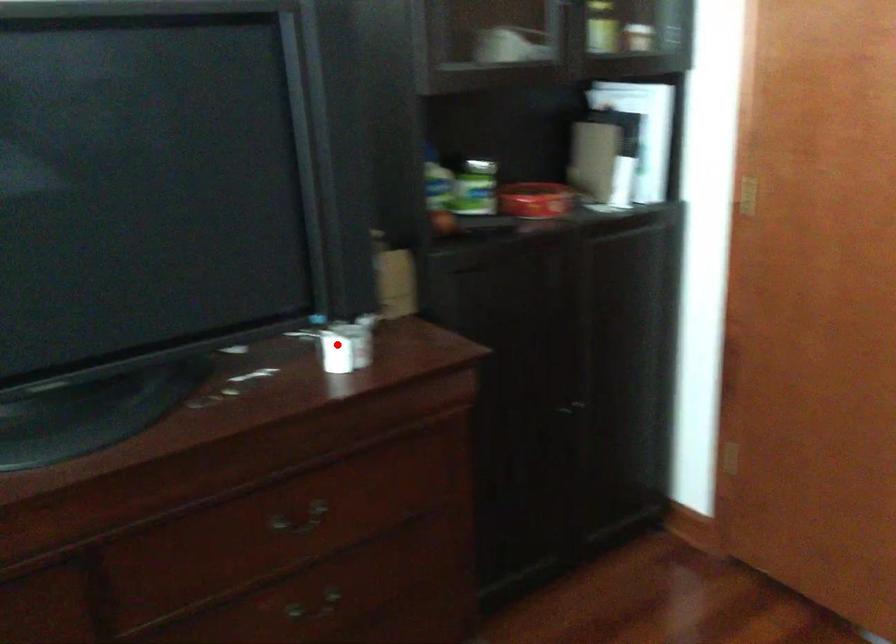
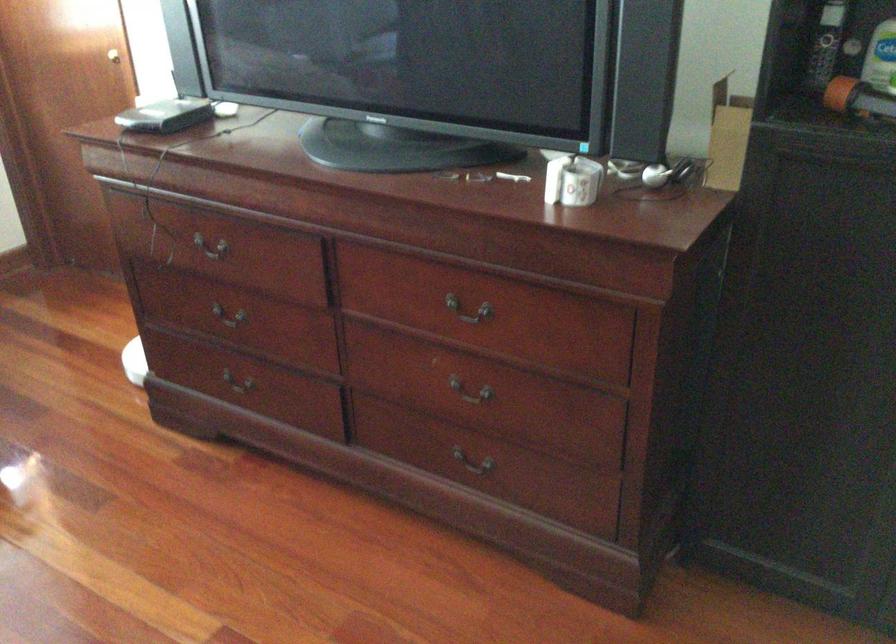
The point at the highlighted location is marked in the first image. Where is the corresponding point in the second image?

(572, 180)